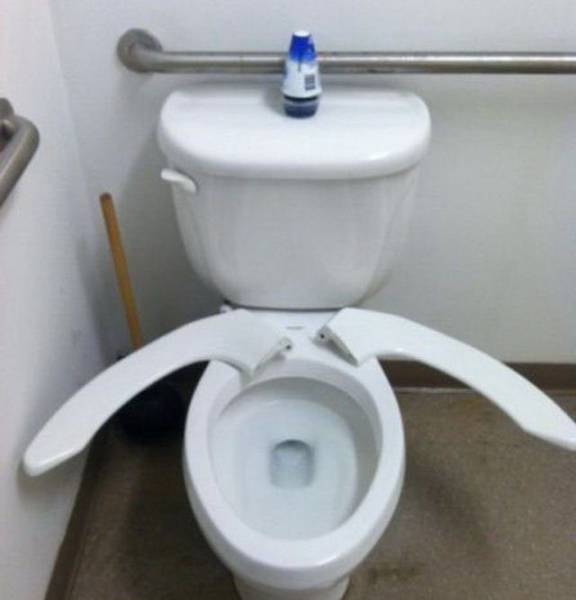
You are a GUI agent. You are given a task and a screenshot of the screen. Output one action in this format:
    pyautogui.click(x=<x>, y=<y>)
    Task: Click on the toilet bowl
    
    Given the screenshot: What is the action you would take?
    coord(253,486)